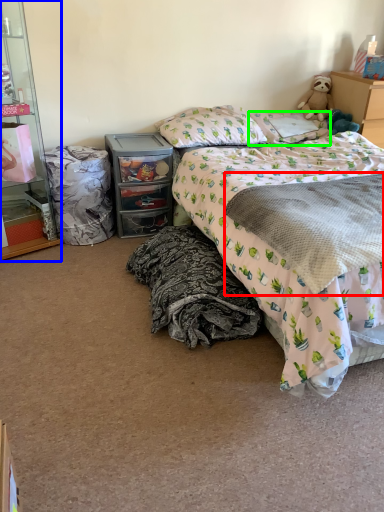
Question: Based on their relative distances, which object is farther from blanket (highlighted by a red box)? Choose from cabinetry (highlighted by a blue box) and pillow (highlighted by a green box).

Choices:
 (A) cabinetry
 (B) pillow

Answer: (A)